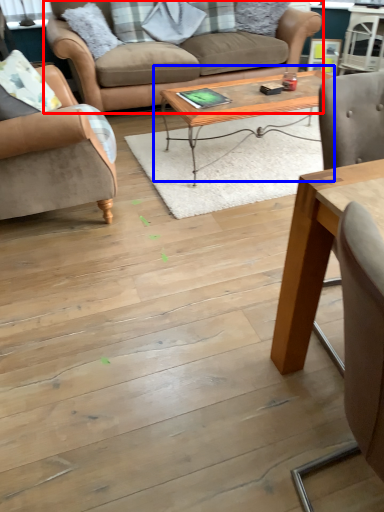
Question: Among these objects, which one is farthest to the camera, studio couch (highlighted by a red box) or coffee table (highlighted by a blue box)?

Choices:
 (A) studio couch
 (B) coffee table

Answer: (A)